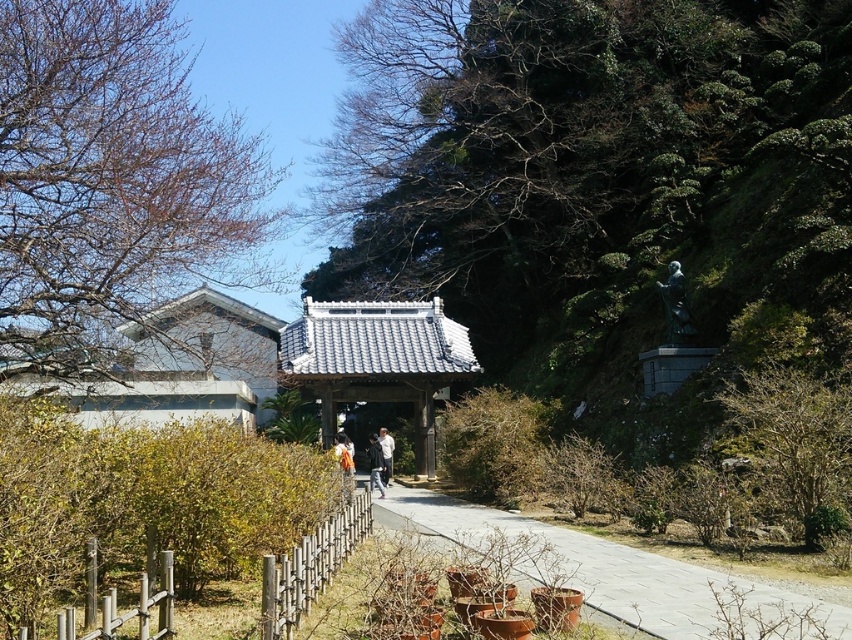
Question: Is wooden fence at lower left closer to camera compared to white matte person at center?

Choices:
 (A) no
 (B) yes

Answer: (B)

Question: Which object is the closest to the smooth concrete path at center?

Choices:
 (A) wooden fence at lower left
 (B) orange fabric at center
 (C) bare branches at upper left
 (D) wooden fence at lower center

Answer: (B)

Question: Based on their relative distances, which object is nearer to the dark gray jacket at center?

Choices:
 (A) white matte person at center
 (B) smooth concrete path at center

Answer: (A)

Question: Observing the image, what is the correct spatial positioning of white matte person at center in reference to orange fabric at center?

Choices:
 (A) left
 (B) right

Answer: (B)

Question: From the image, what is the correct spatial relationship of wooden fence at lower center in relation to white matte person at center?

Choices:
 (A) above
 (B) below

Answer: (A)

Question: Which point appears farthest from the camera in this image?

Choices:
 (A) (373, 472)
 (B) (6, 13)

Answer: (A)